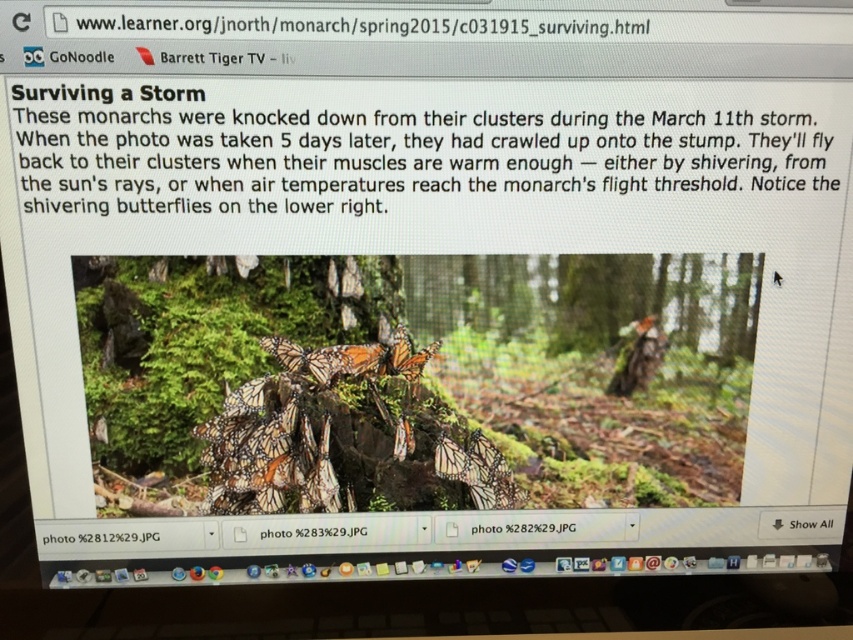
Question: Is matte orange butterfly at center wider than translucent orange wings at center?

Choices:
 (A) yes
 (B) no

Answer: (A)

Question: Does matte orange butterfly at center have a larger size compared to translucent orange wings at center?

Choices:
 (A) no
 (B) yes

Answer: (A)

Question: Which of the following is the closest to the observer?

Choices:
 (A) translucent orange wings at center
 (B) matte orange butterfly at center

Answer: (A)

Question: Which point is closer to the camera?

Choices:
 (A) matte orange butterfly at center
 (B) translucent orange wings at center

Answer: (B)

Question: Observing the image, what is the correct spatial positioning of matte orange butterfly at center in reference to translucent orange wings at center?

Choices:
 (A) below
 (B) above

Answer: (A)